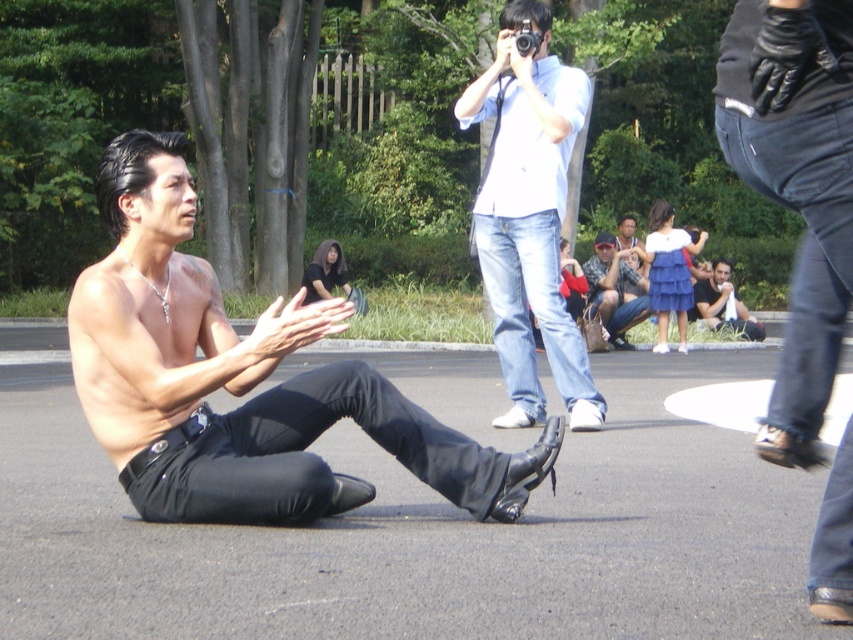
You are a photographer trying to capture both the shiny black pants at center and the white cotton shirt at upper center in a single frame. Based on their positions, which object should you focus on first to ensure both are in focus?

The shiny black pants at center is shorter than the white cotton shirt at upper center, so you should focus on the shiny black pants at center first to ensure both are in focus.

You are a photographer trying to capture a clear shot of both the white cotton shirt at upper center and the matte blue jeans at center. Since you want both subjects to be in focus, which one should you adjust your camera focus on first?

The white cotton shirt at upper center is in front of the matte blue jeans at center, so you should focus on the white cotton shirt at upper center first to ensure both are in focus.

You are a photographer trying to capture the man in the shiny black pants at center and the person in the black cotton shirt at lower right in the same frame. Based on their positions, which one is closer to the camera?

The shiny black pants at center is below black cotton shirt at lower right, so the shiny black pants at center is closer to the camera than the black cotton shirt at lower right.